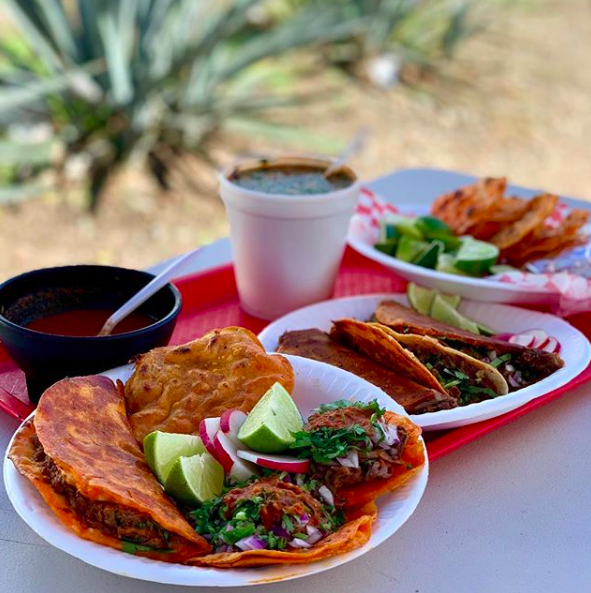
Image resolution: width=591 pixels, height=593 pixels. What are the coordinates of `tray` in the screenshot? It's located at (226, 302).